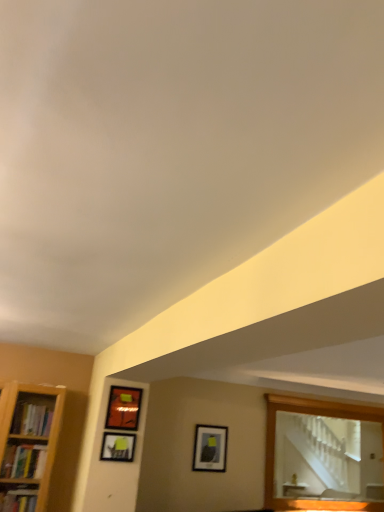
What are the coordinates of `wooden mirror at upper right` in the screenshot? It's located at (307, 413).

From the picture: What is the approximate height of wooden mirror at upper right?

1.06 meters.

Image resolution: width=384 pixels, height=512 pixels. What do you see at coordinates (123, 408) in the screenshot?
I see `matte orange picture frame at upper left, the 2th picture frame positioned from the back` at bounding box center [123, 408].

At what (x,y) coordinates should I click in order to perform the action: click on matte black picture frame at center, which is the first picture frame from right to left. Please return your answer as a coordinate pair (x, y). The height and width of the screenshot is (512, 384). Looking at the image, I should click on (210, 448).

Is wooden mirror at upper right looking in the opposite direction of matte black picture frame at center, the 3th picture frame viewed from the top?

wooden mirror at upper right does not have its back to matte black picture frame at center, the 3th picture frame viewed from the top.

Which object is further away from the camera, wooden mirror at upper right or matte black picture frame at center, which is the first picture frame from right to left?

wooden mirror at upper right is behind.

From the image's perspective, is wooden mirror at upper right located above or below matte black picture frame at center, which ranks as the first picture frame in back-to-front order?

Clearly, from the image's perspective, wooden mirror at upper right is below matte black picture frame at center, which ranks as the first picture frame in back-to-front order.

Is matte black picture frame at upper center, which ranks as the first picture frame in left-to-right order, positioned with its back to matte orange picture frame at upper left, the second picture frame positioned from the front?

matte black picture frame at upper center, which ranks as the first picture frame in left-to-right order, is not turned away from matte orange picture frame at upper left, the second picture frame positioned from the front.

Is matte black picture frame at upper center, the 1th picture frame positioned from the front, to the left of matte orange picture frame at upper left, the second picture frame viewed from the left, from the viewer's perspective?

Yes.

Is point (110, 456) closer or farther from the camera than point (125, 407)?

Clearly, point (110, 456) is closer to the camera than point (125, 407).

How different are the orientations of matte black picture frame at upper center, which ranks as the first picture frame in left-to-right order, and matte orange picture frame at upper left, the second picture frame from the right, in degrees?

The angle between the facing direction of matte black picture frame at upper center, which ranks as the first picture frame in left-to-right order, and the facing direction of matte orange picture frame at upper left, the second picture frame from the right, is 0.0387 degrees.

Is wooden mirror at upper right not close to matte orange picture frame at upper left, the second picture frame from the right?

Yes, wooden mirror at upper right is far from matte orange picture frame at upper left, the second picture frame from the right.

Is the depth of wooden mirror at upper right greater than that of matte orange picture frame at upper left, the second picture frame from the right?

Yes, it is.

Considering the sizes of objects wooden mirror at upper right and matte orange picture frame at upper left, the second picture frame viewed from the left, in the image provided, who is bigger, wooden mirror at upper right or matte orange picture frame at upper left, the second picture frame viewed from the left,?

Bigger between the two is wooden mirror at upper right.

Where is `mirror on the right of matte orange picture frame at upper left, which is the 3th picture frame in bottom-to-top order`? The height and width of the screenshot is (512, 384). mirror on the right of matte orange picture frame at upper left, which is the 3th picture frame in bottom-to-top order is located at coordinates tap(307, 413).

Based on the photo, does matte orange picture frame at upper left, marked as the first picture frame in a top-to-bottom arrangement, come in front of matte black picture frame at upper center, which appears as the third picture frame when viewed from the back?

That is False.

How many degrees apart are the facing directions of matte orange picture frame at upper left, marked as the first picture frame in a top-to-bottom arrangement, and matte black picture frame at upper center, positioned as the second picture frame in top-to-bottom order?

There is a 0.0387-degree angle between the facing directions of matte orange picture frame at upper left, marked as the first picture frame in a top-to-bottom arrangement, and matte black picture frame at upper center, positioned as the second picture frame in top-to-bottom order.

Find the location of a particular element. Image resolution: width=384 pixels, height=512 pixels. the 2nd picture frame directly above the matte black picture frame at upper center, which appears as the third picture frame when viewed from the back (from a real-world perspective) is located at coordinates (123, 408).

From the image's perspective, is matte orange picture frame at upper left, which is the 3th picture frame in bottom-to-top order, above or below matte black picture frame at upper center, which appears as the third picture frame when viewed from the back?

From the image's perspective, matte orange picture frame at upper left, which is the 3th picture frame in bottom-to-top order, appears above matte black picture frame at upper center, which appears as the third picture frame when viewed from the back.

From the image's perspective, is matte black picture frame at center, which is the first picture frame from right to left, on wooden mirror at upper right?

Indeed, from the image's perspective, matte black picture frame at center, which is the first picture frame from right to left, is shown above wooden mirror at upper right.

Can you confirm if matte black picture frame at center, which ranks as the first picture frame in back-to-front order, is shorter than wooden mirror at upper right?

Yes, matte black picture frame at center, which ranks as the first picture frame in back-to-front order, is shorter than wooden mirror at upper right.

Based on the photo, is matte black picture frame at center, which is the first picture frame from right to left, situated inside wooden mirror at upper right or outside?

matte black picture frame at center, which is the first picture frame from right to left, is located beyond the bounds of wooden mirror at upper right.

Does matte black picture frame at center, acting as the third picture frame starting from the front, come in front of matte orange picture frame at upper left, the second picture frame positioned from the front?

No, matte black picture frame at center, acting as the third picture frame starting from the front, is behind matte orange picture frame at upper left, the second picture frame positioned from the front.

Which is more to the right, matte black picture frame at center, the 3th picture frame viewed from the top, or matte orange picture frame at upper left, the 2th picture frame positioned from the back?

matte black picture frame at center, the 3th picture frame viewed from the top.

At what (x,y) coordinates should I click in order to perform the action: click on picture frame above the matte black picture frame at center, the 3th picture frame viewed from the top (from a real-world perspective). Please return your answer as a coordinate pair (x, y). This screenshot has height=512, width=384. Looking at the image, I should click on (123, 408).

There is a matte black picture frame at upper center, which appears as the third picture frame when viewed from the back. Where is `mirror above it (from a real-world perspective)`? This screenshot has width=384, height=512. mirror above it (from a real-world perspective) is located at coordinates (307, 413).

Which point is more forward, (372, 416) or (119, 437)?

The point (119, 437) is closer to the camera.

From the image's perspective, is wooden mirror at upper right under matte black picture frame at upper center, the 1th picture frame positioned from the front?

Correct, wooden mirror at upper right appears lower than matte black picture frame at upper center, the 1th picture frame positioned from the front, in the image.

Identify the location of mirror below the matte black picture frame at center, the 3th picture frame viewed from the top (from the image's perspective). The image size is (384, 512). (307, 413).

Identify the location of picture frame in front of the matte orange picture frame at upper left, which is the 3th picture frame in bottom-to-top order. (118, 447).

When comparing their distances from wooden mirror at upper right, does matte black picture frame at upper center, which appears as the third picture frame when viewed from the back, or matte orange picture frame at upper left, the second picture frame from the right, seem further?

Based on the image, matte black picture frame at upper center, which appears as the third picture frame when viewed from the back, appears to be further to wooden mirror at upper right.

From the image, which object appears to be farther from matte black picture frame at center, which is the first picture frame from right to left, matte black picture frame at upper center, positioned as the second picture frame in top-to-bottom order, or matte orange picture frame at upper left, which is the 3th picture frame in bottom-to-top order?

Based on the image, matte orange picture frame at upper left, which is the 3th picture frame in bottom-to-top order, appears to be further to matte black picture frame at center, which is the first picture frame from right to left.

Looking at the image, which one is located closer to matte black picture frame at center, acting as the third picture frame starting from the front, wooden mirror at upper right or matte black picture frame at upper center, the 1th picture frame positioned from the front?

The object closer to matte black picture frame at center, acting as the third picture frame starting from the front, is wooden mirror at upper right.

Consider the image. From the image, which object appears to be farther from wooden mirror at upper right, matte orange picture frame at upper left, the second picture frame from the right, or matte black picture frame at upper center, positioned as the second picture frame in top-to-bottom order?

matte black picture frame at upper center, positioned as the second picture frame in top-to-bottom order.

When comparing their distances from matte orange picture frame at upper left, the second picture frame from the right, does wooden mirror at upper right or matte black picture frame at center, acting as the third picture frame starting from the front, seem further?

wooden mirror at upper right is positioned further to the anchor matte orange picture frame at upper left, the second picture frame from the right.

Estimate the real-world distances between objects in this image. Which object is closer to matte orange picture frame at upper left, the second picture frame from the right, wooden mirror at upper right or matte black picture frame at upper center, positioned as the second picture frame in bottom-to-top order?

matte black picture frame at upper center, positioned as the second picture frame in bottom-to-top order.

Based on their spatial positions, is matte orange picture frame at upper left, marked as the first picture frame in a top-to-bottom arrangement, or matte black picture frame at center, acting as the third picture frame starting from the front, further from wooden mirror at upper right?

Among the two, matte orange picture frame at upper left, marked as the first picture frame in a top-to-bottom arrangement, is located further to wooden mirror at upper right.

Considering their positions, is matte black picture frame at upper center, which ranks as the first picture frame in left-to-right order, positioned further to matte orange picture frame at upper left, marked as the first picture frame in a top-to-bottom arrangement, than matte black picture frame at center, which ranks as the first picture frame in back-to-front order?

matte black picture frame at center, which ranks as the first picture frame in back-to-front order, is positioned further to the anchor matte orange picture frame at upper left, marked as the first picture frame in a top-to-bottom arrangement.

You are a GUI agent. You are given a task and a screenshot of the screen. Output one action in this format:
    pyautogui.click(x=<x>, y=<y>)
    Task: Click on the picture frame located between matte orange picture frame at upper left, the second picture frame positioned from the front, and wooden mirror at upper right in the left-right direction
    Image resolution: width=384 pixels, height=512 pixels.
    Given the screenshot: What is the action you would take?
    pyautogui.click(x=210, y=448)

The height and width of the screenshot is (512, 384). Identify the location of picture frame located between matte black picture frame at upper center, positioned as the second picture frame in top-to-bottom order, and matte black picture frame at center, which is the first picture frame from right to left, in the depth direction. (123, 408).